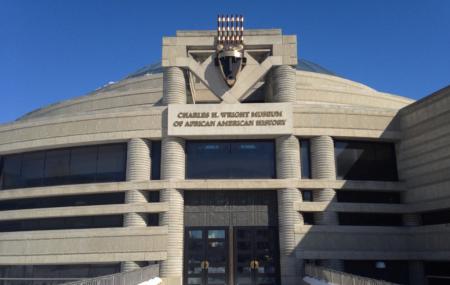
The image size is (450, 285). What are the coordinates of `glass` in the screenshot? It's located at tap(244, 246), tap(265, 242), tap(217, 244), tap(202, 244), tap(211, 158), tap(263, 156).